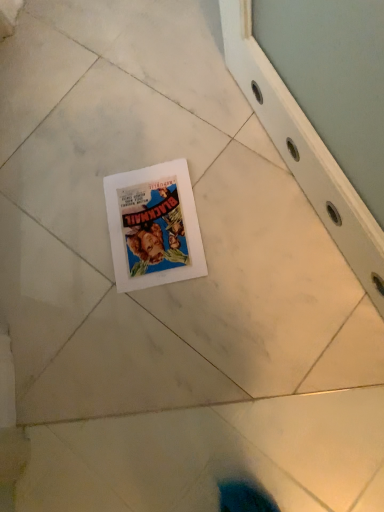
This screenshot has width=384, height=512. Identify the location of vacant space underneath matte paper comic book at center (from a real-world perspective). (150, 226).